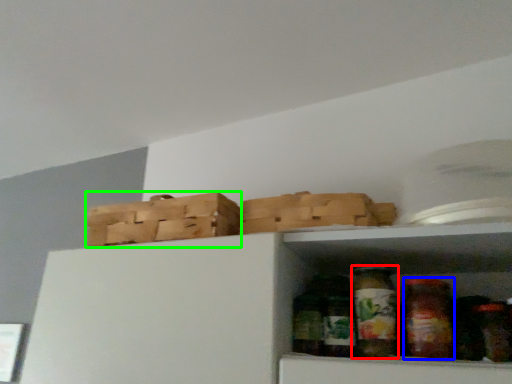
Question: Considering the real-world distances, which object is farthest from glass jar (highlighted by a red box)? glass jar (highlighted by a blue box) or basket (highlighted by a green box)?

Choices:
 (A) glass jar
 (B) basket

Answer: (B)